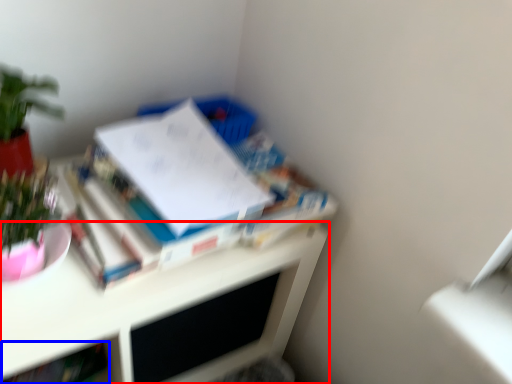
Question: Which object is further to the camera taking this photo, desk (highlighted by a red box) or book (highlighted by a blue box)?

Choices:
 (A) desk
 (B) book

Answer: (B)